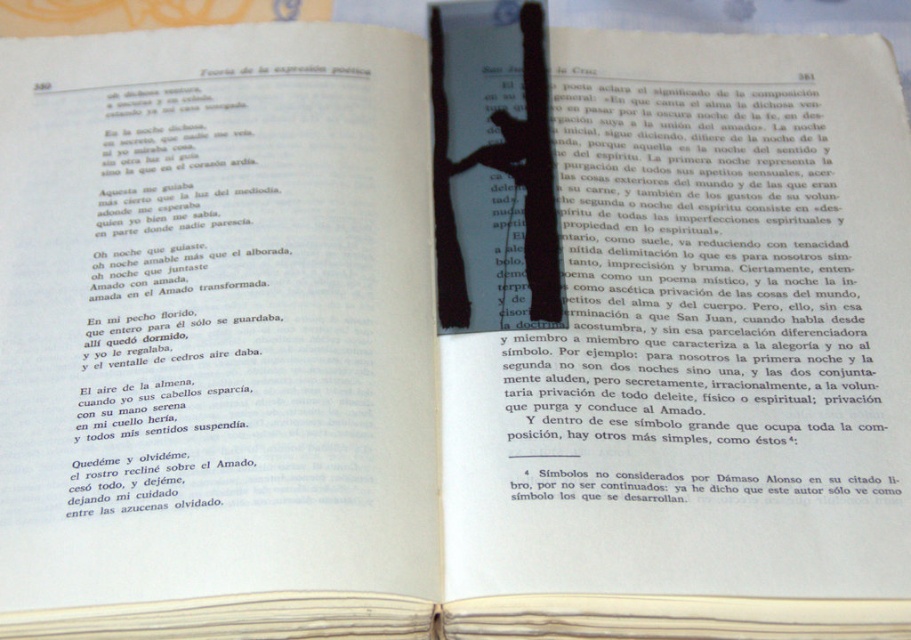
Question: Is black paper at upper center below black paper bookmark at center?

Choices:
 (A) no
 (B) yes

Answer: (B)

Question: Can you confirm if black paper at upper center is thinner than black paper bookmark at center?

Choices:
 (A) yes
 (B) no

Answer: (B)

Question: Which of the following is the farthest from the observer?

Choices:
 (A) (724, 257)
 (B) (464, 157)

Answer: (B)

Question: Observing the image, what is the correct spatial positioning of black paper at upper center in reference to black paper bookmark at center?

Choices:
 (A) below
 (B) above

Answer: (A)